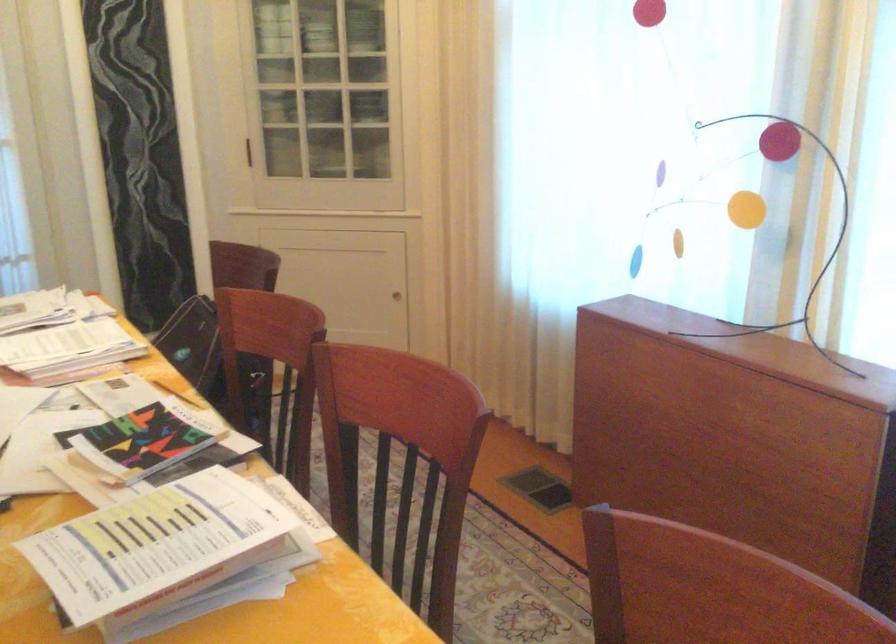
What do you see at coordinates (395, 295) in the screenshot? I see `the small cabinet knob` at bounding box center [395, 295].